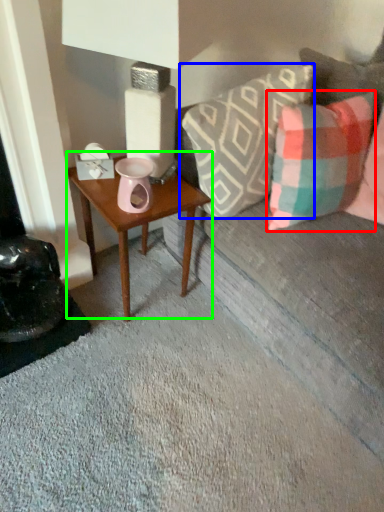
Question: Which is farther away from pillow (highlighted by a red box)? pillow (highlighted by a blue box) or table (highlighted by a green box)?

Choices:
 (A) pillow
 (B) table

Answer: (B)